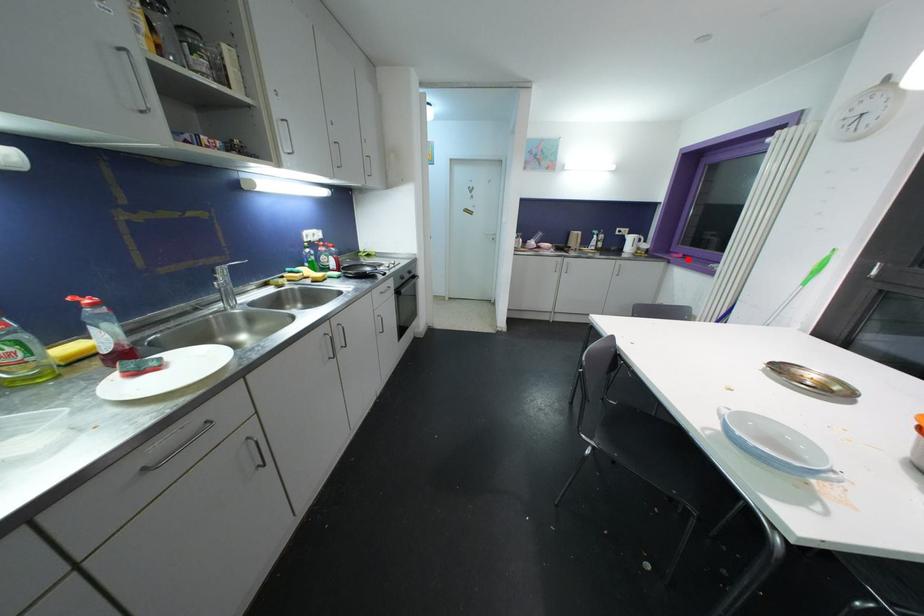
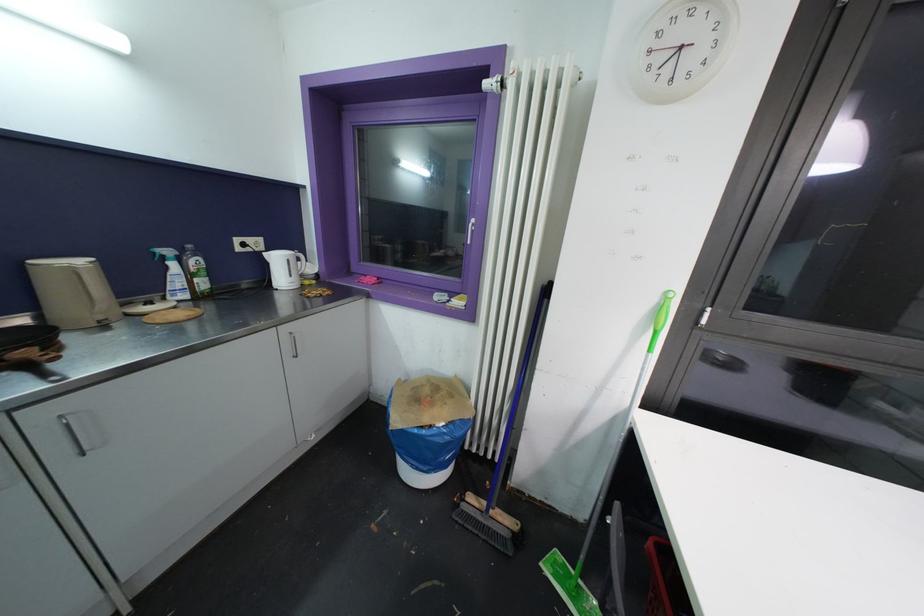
Question: I am providing you with two images of the same scene from different viewpoints. A red point is shown in image1. For the corresponding object point in image2, is it positioned nearer or farther from the camera?

Choices:
 (A) Nearer
 (B) Farther

Answer: (B)